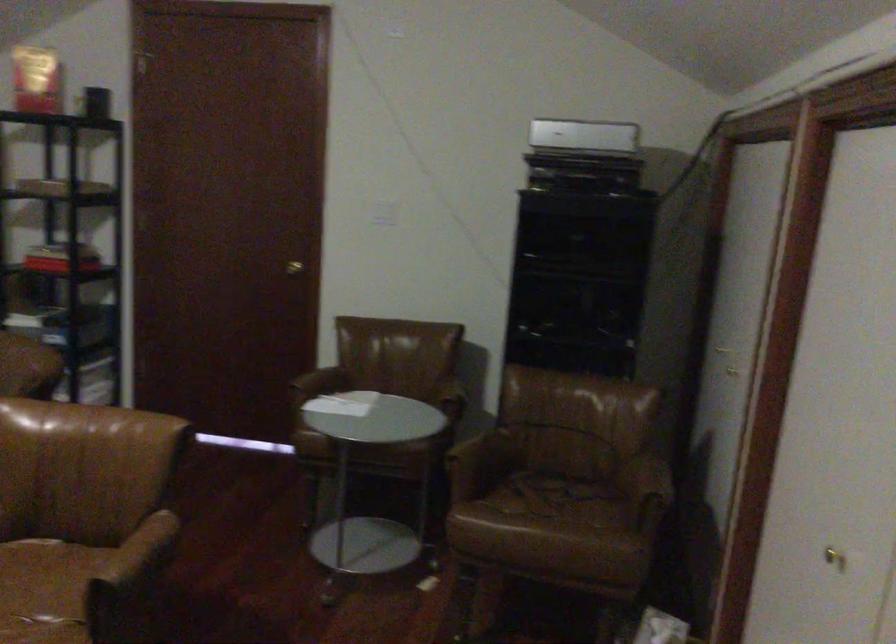
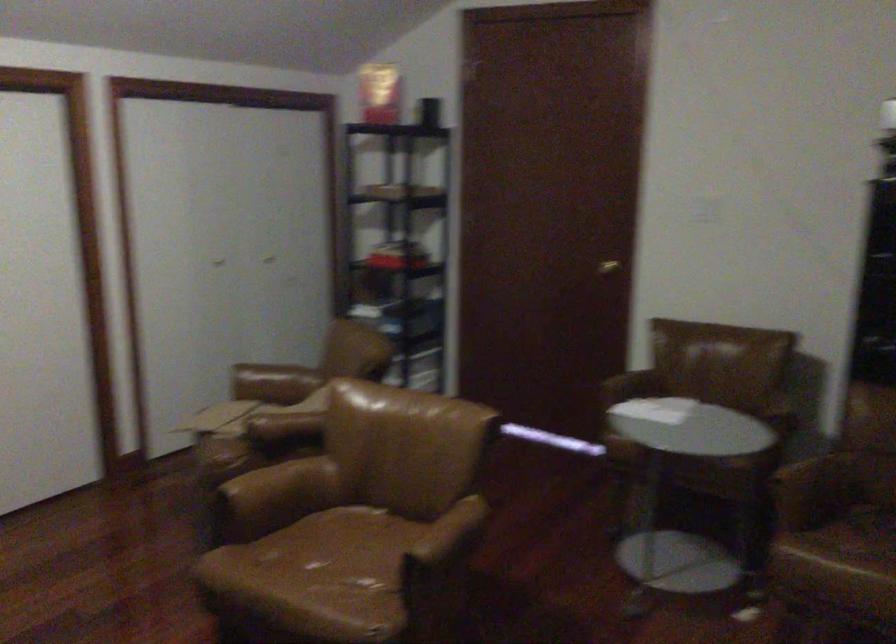
Where in the second image is the point corresponding to point 281,269 from the first image?

(607, 267)